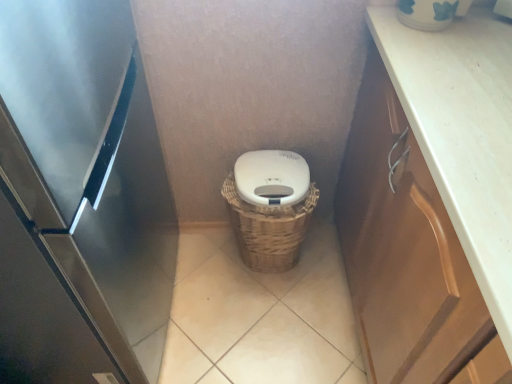
This screenshot has width=512, height=384. Find the location of `vacant space in front of woven brown basket at center`. vacant space in front of woven brown basket at center is located at coordinates 269,314.